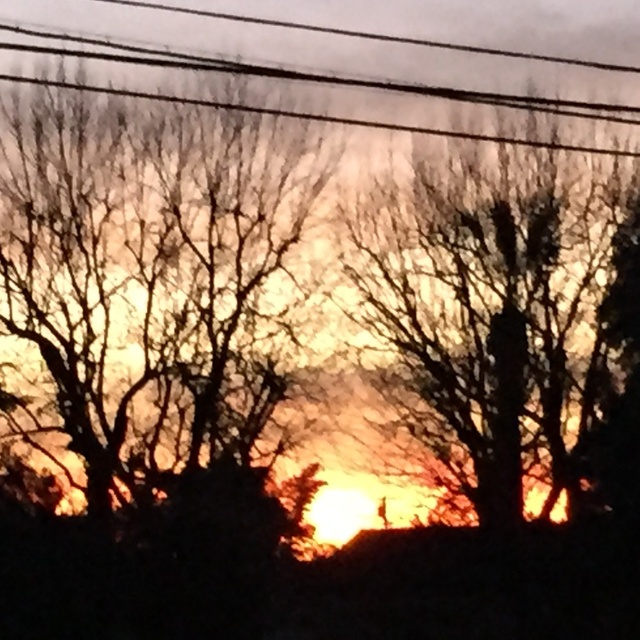
Based on the photo, which is more to the left, silhouette bark tree at center or silhouette bare tree at center?

Positioned to the left is silhouette bark tree at center.

Is silhouette bark tree at center shorter than silhouette bare tree at center?

No, silhouette bark tree at center is not shorter than silhouette bare tree at center.

This screenshot has width=640, height=640. What do you see at coordinates (150, 275) in the screenshot?
I see `silhouette bark tree at center` at bounding box center [150, 275].

At what (x,y) coordinates should I click in order to perform the action: click on silhouette bark tree at center. Please return your answer as a coordinate pair (x, y). Looking at the image, I should click on (150, 275).

Can you confirm if silhouette bare tree at center is wider than black wire at upper center?

No, silhouette bare tree at center is not wider than black wire at upper center.

Who is more forward, (451, 317) or (566, 106)?

Point (566, 106)

Between point (513, 348) and point (531, 106), which one is positioned in front?

Positioned in front is point (531, 106).

Identify the location of silhouette bare tree at center. (493, 317).

Between silhouette bark tree at center and black wire at upper center, which one is positioned higher?

black wire at upper center

Between point (58, 129) and point (573, 99), which one is positioned behind?

Point (573, 99)

Who is more distant from viewer, (241, 340) or (179, 65)?

Positioned behind is point (241, 340).

I want to click on silhouette bark tree at center, so click(x=150, y=275).